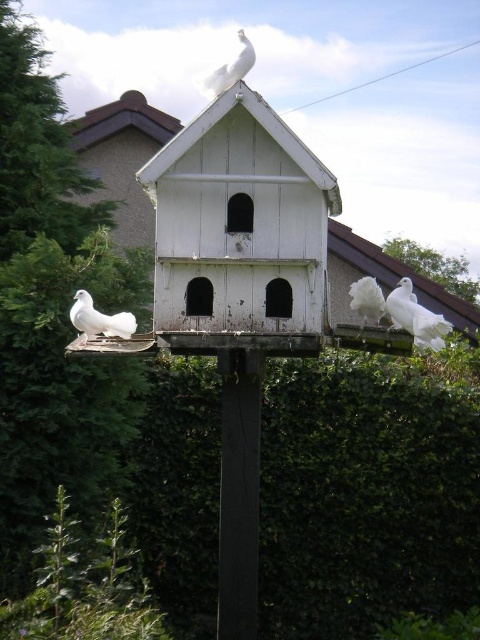
Consider the image. You are a birdwatcher observing the scene. You notice the white feathered dove at right and the white feathered peacock at upper center. Which bird takes up more space in the image?

The white feathered peacock at upper center takes up more space in the image than the white feathered dove at right.

You are a bird flying towards the green leafy hedge at center and the white wood bird feeder at center. Which one will you reach first?

The green leafy hedge at center is positioned on the right side of white wood bird feeder at center, so you will reach the white wood bird feeder at center first before reaching the green leafy hedge at center.